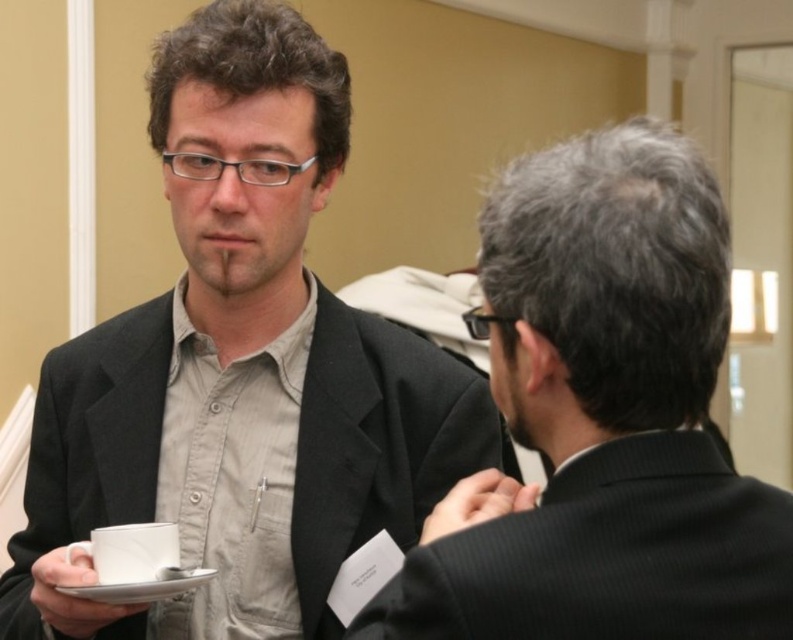
Question: Among these objects, which one is farthest from the camera?

Choices:
 (A) white ceramic saucer at lower left
 (B) black pinstripe suit at right

Answer: (A)

Question: Which is farther from the matte black suit at center?

Choices:
 (A) white ceramic saucer at lower left
 (B) white ceramic cup at lower left
 (C) black pinstripe suit at right

Answer: (C)

Question: Can you confirm if black pinstripe suit at right is wider than white ceramic cup at lower left?

Choices:
 (A) yes
 (B) no

Answer: (A)

Question: Which point appears farthest from the camera in this image?

Choices:
 (A) (140, 600)
 (B) (308, 573)

Answer: (B)

Question: Where is black pinstripe suit at right located in relation to white ceramic cup at lower left in the image?

Choices:
 (A) below
 (B) above

Answer: (B)

Question: Does black pinstripe suit at right have a smaller size compared to white ceramic saucer at lower left?

Choices:
 (A) yes
 (B) no

Answer: (B)